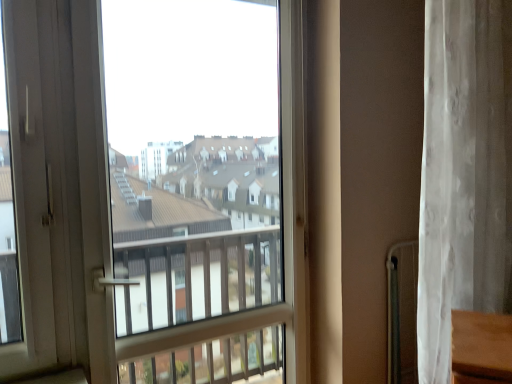
Question: Is white sheer curtain at right at the back of transparent glass window at center?

Choices:
 (A) no
 (B) yes

Answer: (A)

Question: Is transparent glass window at center at the right side of white sheer curtain at right?

Choices:
 (A) no
 (B) yes

Answer: (A)

Question: Is transparent glass window at center far from white sheer curtain at right?

Choices:
 (A) no
 (B) yes

Answer: (A)

Question: From the image's perspective, would you say transparent glass window at center is shown under white sheer curtain at right?

Choices:
 (A) no
 (B) yes

Answer: (B)

Question: Can you confirm if transparent glass window at center is positioned to the left of white sheer curtain at right?

Choices:
 (A) yes
 (B) no

Answer: (A)

Question: Considering the relative sizes of transparent glass window at center and white sheer curtain at right in the image provided, is transparent glass window at center taller than white sheer curtain at right?

Choices:
 (A) no
 (B) yes

Answer: (B)

Question: Is white sheer curtain at right shorter than white plastic screen door at left?

Choices:
 (A) yes
 (B) no

Answer: (B)

Question: Is white sheer curtain at right positioned behind white plastic screen door at left?

Choices:
 (A) yes
 (B) no

Answer: (A)

Question: From the image's perspective, does white sheer curtain at right appear higher than white plastic screen door at left?

Choices:
 (A) no
 (B) yes

Answer: (B)

Question: Is white sheer curtain at right thinner than white plastic screen door at left?

Choices:
 (A) no
 (B) yes

Answer: (A)

Question: From the image's perspective, is white sheer curtain at right beneath white plastic screen door at left?

Choices:
 (A) no
 (B) yes

Answer: (A)

Question: Can you confirm if white sheer curtain at right is positioned to the right of white plastic screen door at left?

Choices:
 (A) yes
 (B) no

Answer: (A)

Question: Can you confirm if white sheer curtain at right is positioned to the left of transparent glass window at center?

Choices:
 (A) no
 (B) yes

Answer: (A)